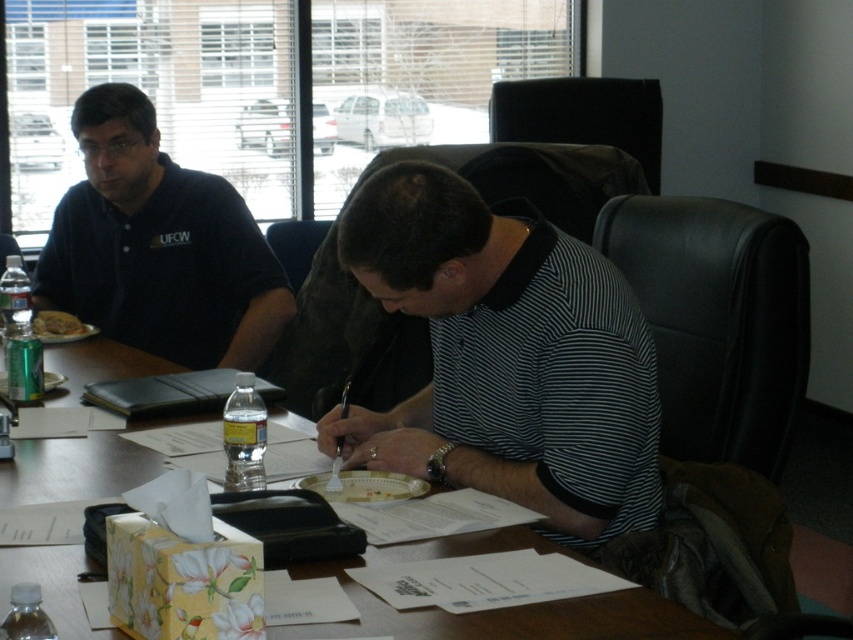
Is wooden table at center shorter than black leather folder at center?

In fact, wooden table at center may be taller than black leather folder at center.

You are a GUI agent. You are given a task and a screenshot of the screen. Output one action in this format:
    pyautogui.click(x=<x>, y=<y>)
    Task: Click on the wooden table at center
    Image resolution: width=853 pixels, height=640 pixels.
    Given the screenshot: What is the action you would take?
    pyautogui.click(x=502, y=609)

Can you confirm if black striped shirt at center is smaller than black leather folder at center?

Incorrect, black striped shirt at center is not smaller in size than black leather folder at center.

The height and width of the screenshot is (640, 853). Describe the element at coordinates (505, 358) in the screenshot. I see `black striped shirt at center` at that location.

Does point (358, 444) come farther from viewer compared to point (231, 369)?

That is False.

I want to click on black striped shirt at center, so click(x=505, y=358).

From the picture: Who is higher up, black striped shirt at center or matte black polo shirt at left?

matte black polo shirt at left is above.

Is point (503, 253) positioned before point (99, 161)?

Yes.

Does point (599, 296) come closer to viewer compared to point (229, 227)?

Yes, point (599, 296) is in front of point (229, 227).

This screenshot has width=853, height=640. I want to click on black striped shirt at center, so click(x=505, y=358).